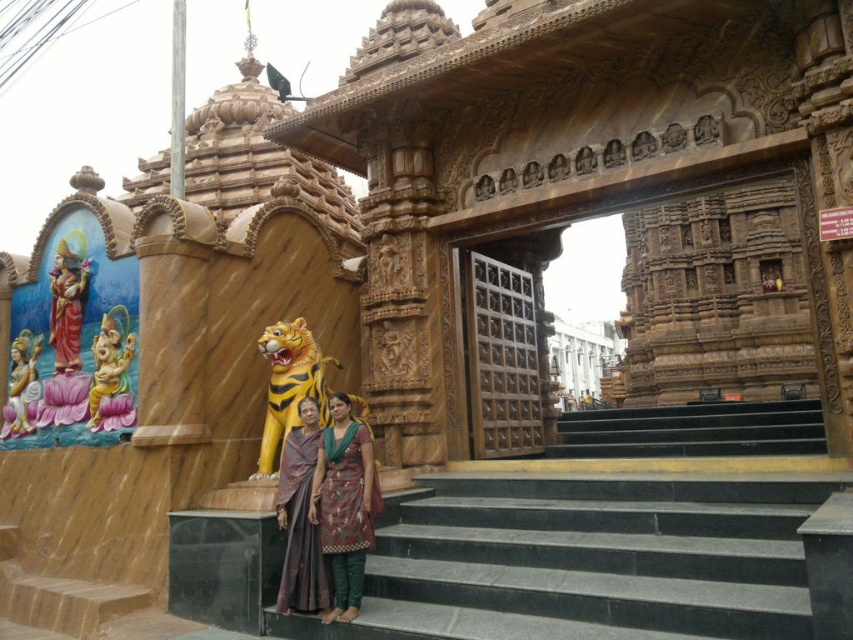
You are an art student visiting the temple and want to sketch the statues. You notice two golden statues at the left side of the entrance. Which statue has a smaller width between the polished gold statue at left and the golden statue at left?

The polished gold statue at left has a lesser width compared to the golden statue at left, so the polished gold statue at left is smaller in width.

You are standing in front of the temple entrance and want to take a photo. You notice two points marked in the scene. The first point is at coordinates point [73,317] and the second is at point [26,408]. Which point is closer to your camera lens?

Point [73,317] is closer to the camera than point [26,408] according to the description.